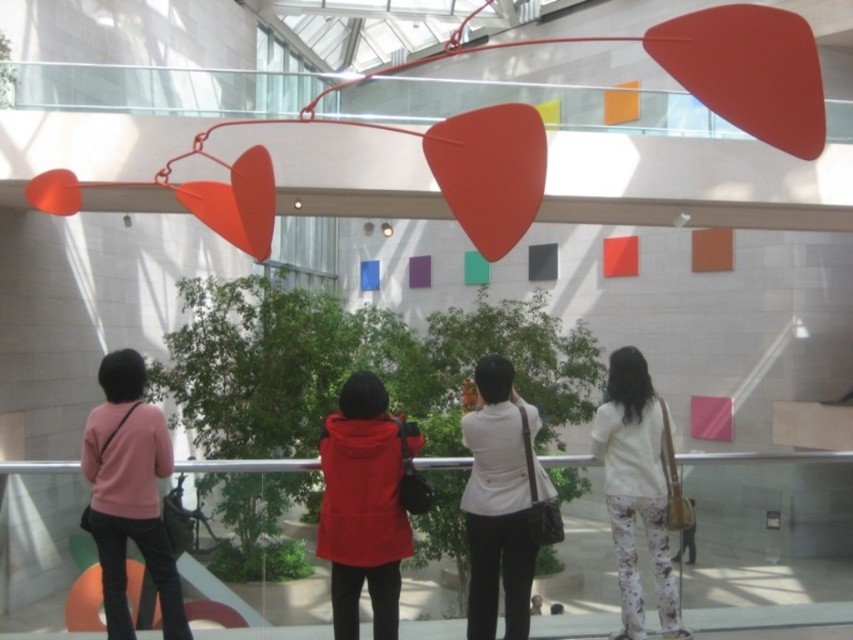
Between pink matte sweater at lower left and white matte blouse at center, which one is positioned higher?

pink matte sweater at lower left

Who is more forward, (161, 630) or (503, 397)?

Point (503, 397)

Where is `pink matte sweater at lower left`? Image resolution: width=853 pixels, height=640 pixels. pink matte sweater at lower left is located at coordinates (129, 492).

Which is below, matte red jacket at center or white matte blouse at center?

white matte blouse at center is lower down.

Is point (373, 556) in front of point (506, 636)?

Yes, point (373, 556) is closer to viewer.

What are the coordinates of `matte red jacket at center` in the screenshot? It's located at (364, 504).

Between point (345, 467) and point (155, 406), which one is positioned in front?

Positioned in front is point (345, 467).

Who is more distant from viewer, (x=386, y=497) or (x=83, y=518)?

The point (x=83, y=518) is behind.

You are a GUI agent. You are given a task and a screenshot of the screen. Output one action in this format:
    pyautogui.click(x=<x>, y=<y>)
    Task: Click on the matte red jacket at center
    This screenshot has width=853, height=640.
    Given the screenshot: What is the action you would take?
    (364, 504)